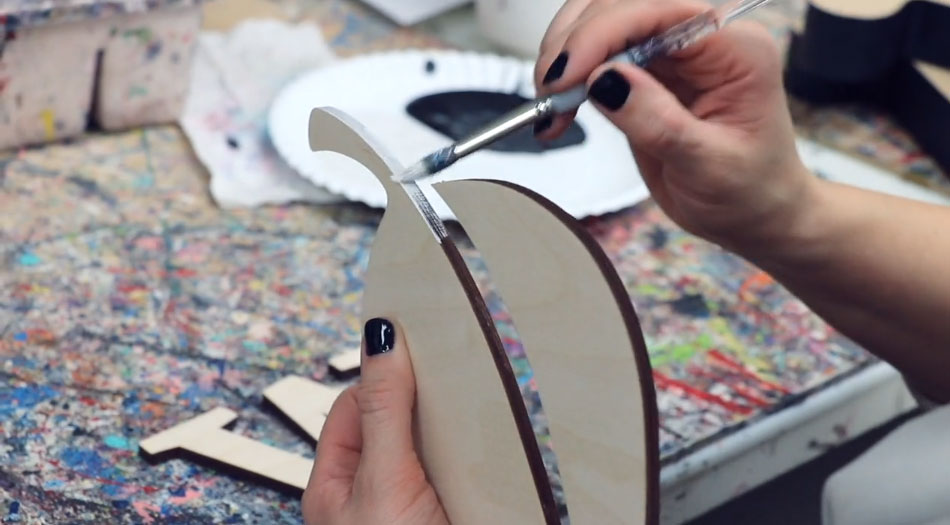
Image resolution: width=950 pixels, height=525 pixels. Identify the location of table. (748, 448).